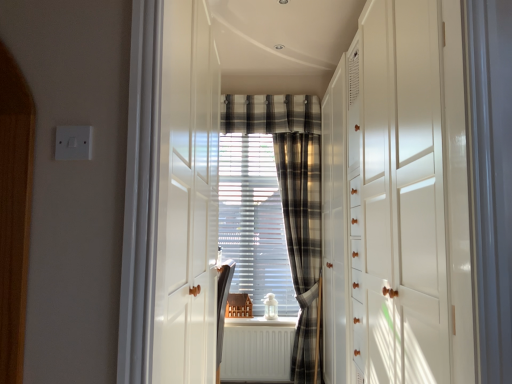
You are a GUI agent. You are given a task and a screenshot of the screen. Output one action in this format:
    pyautogui.click(x=<x>, y=<y>)
    Task: Click on the vacant space situated above plaid fabric curtain at center (from a real-world perspective)
    The height and width of the screenshot is (384, 512).
    Given the screenshot: What is the action you would take?
    pyautogui.click(x=296, y=127)